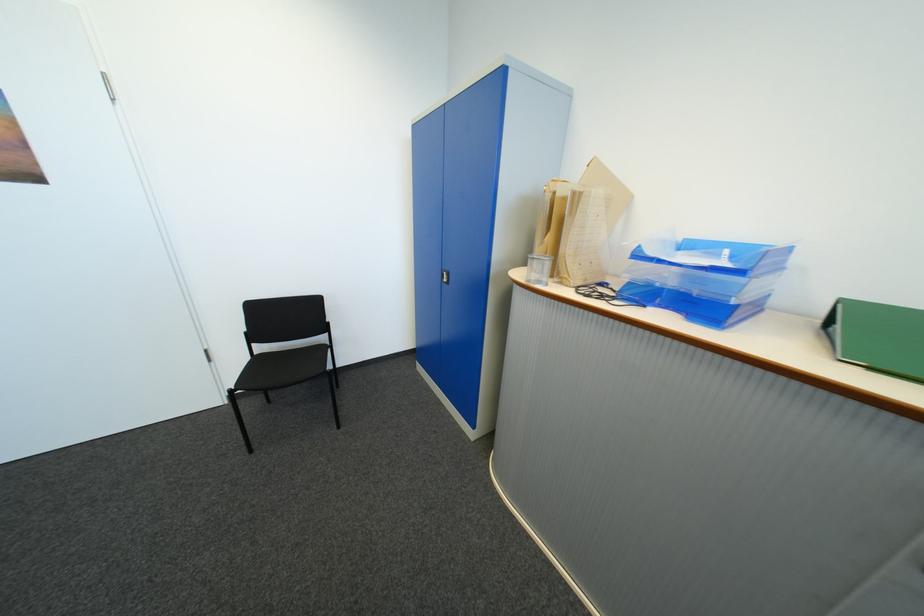
The width and height of the screenshot is (924, 616). Describe the element at coordinates (283, 368) in the screenshot. I see `the chair sitting surface` at that location.